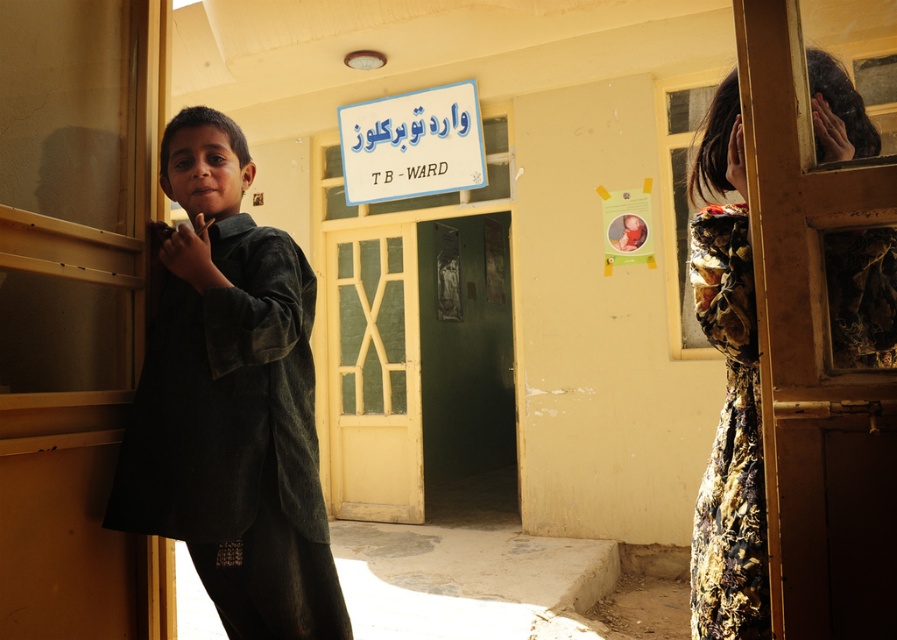
You are standing in the TB ward and need to exit the room. The yellow painted wood door at center is the only exit. To reach it, you must walk straight ahead. Is the door located near the center of the room?

Yes, the yellow painted wood door at center is located at the center of the room because its 2D coordinates are at point (373, 374), which is near the center point of the room.

You are a nurse in the TB ward and need to place a medical chart at point A and a syringe at point B. The coordinates for point A are given as point A is at point (251, 492) and point B is at point (443, 104). If you want to place the items so that the medical chart is closer to the camera, which point should you choose for the medical chart?

Point A at point (251, 492) is closer to the viewer than point B at point (443, 104), so you should place the medical chart at point A to be closer to the camera.